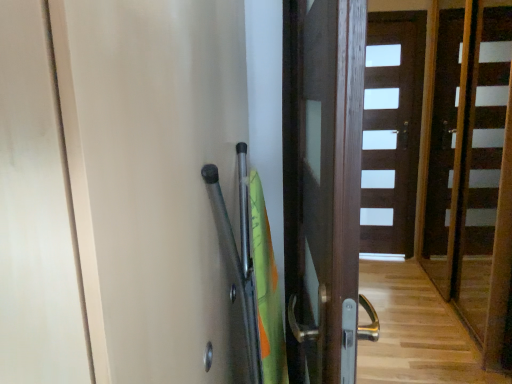
Question: Is point (195, 206) closer or farther from the camera than point (417, 104)?

Choices:
 (A) closer
 (B) farther

Answer: (A)

Question: Is transparent plastic screen door at upper right bigger or smaller than brown wooden door at center, the 1th door in the back-to-front sequence?

Choices:
 (A) small
 (B) big

Answer: (B)

Question: Which object is the closest to the wooden stairs at center?

Choices:
 (A) brown wooden door at center, the 1th door in the back-to-front sequence
 (B) transparent plastic screen door at upper right
 (C) dark wood door at center, arranged as the first door when viewed from the front

Answer: (A)

Question: Estimate the real-world distances between objects in this image. Which object is farther from the transparent plastic screen door at upper right?

Choices:
 (A) brown wooden door at center, which is the first door in right-to-left order
 (B) wooden stairs at center
 (C) dark wood door at center, positioned as the 2th door in back-to-front order

Answer: (A)